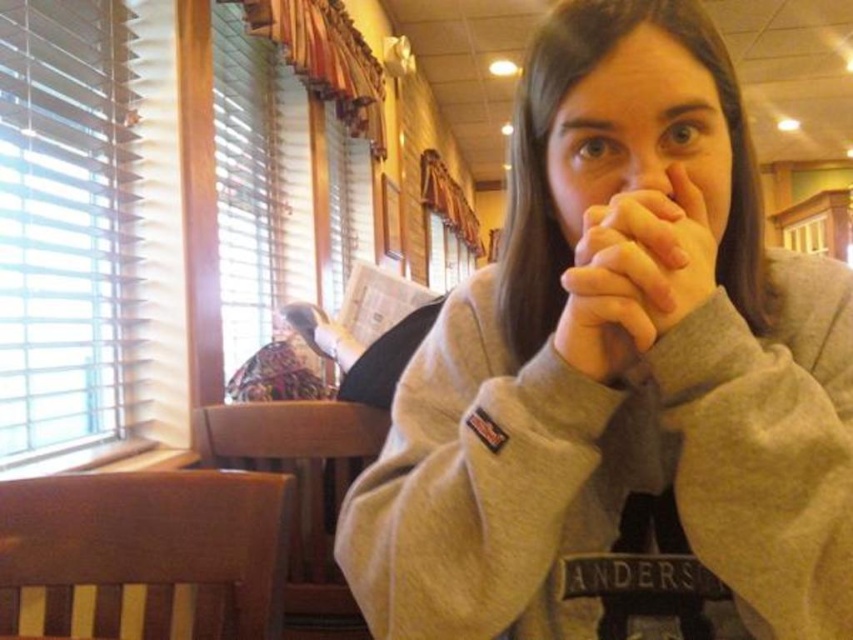
You are an artist sketching the person in the image. You need to decide which part to draw first based on their size. Should you draw the smooth skin hands at center or the matte skin nose at center?

The smooth skin hands at center might be wider than matte skin nose at center, so you should draw the smooth skin hands at center first since they are likely larger.